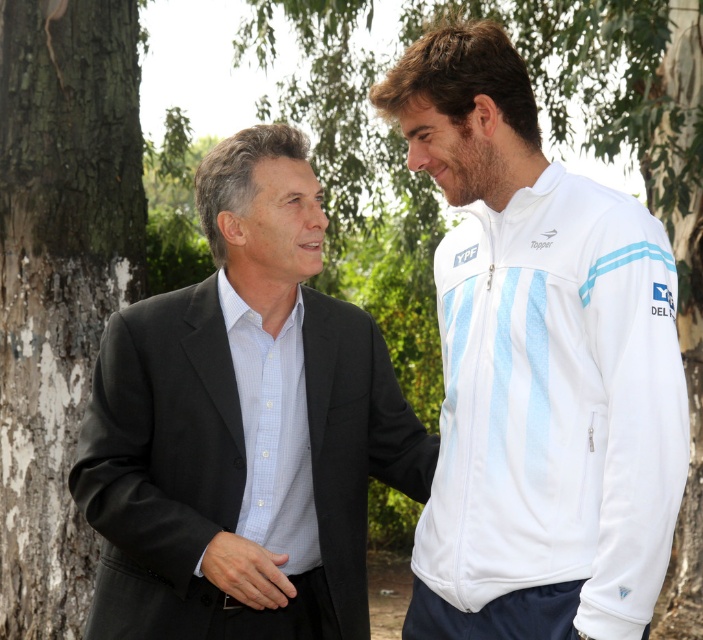
Question: Which object appears closest to the camera in this image?

Choices:
 (A) rough bark tree at left
 (B) black matte suit at left
 (C) white fabric jacket at right
 (D) smooth skin hand at center

Answer: (C)

Question: Is white fabric jacket at right behind black matte suit at left?

Choices:
 (A) no
 (B) yes

Answer: (A)

Question: Which of the following is the closest to the observer?

Choices:
 (A) smooth skin hand at center
 (B) white fabric jacket at right
 (C) rough bark tree at left
 (D) black matte suit at left

Answer: (B)

Question: Is white fabric jacket at right positioned before rough bark tree at left?

Choices:
 (A) yes
 (B) no

Answer: (A)

Question: Estimate the real-world distances between objects in this image. Which object is closer to the black matte suit at left?

Choices:
 (A) rough bark tree at left
 (B) smooth skin hand at center
 (C) white fabric jacket at right

Answer: (B)

Question: Does white fabric jacket at right come behind black matte suit at left?

Choices:
 (A) no
 (B) yes

Answer: (A)